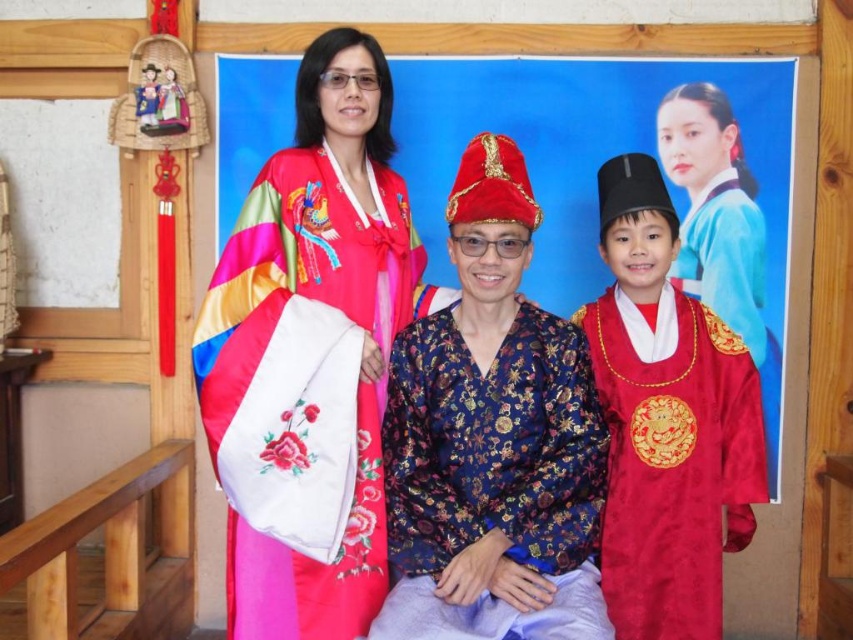
Question: Does silky satin kimono at upper left have a greater width compared to silky red robe at center?

Choices:
 (A) no
 (B) yes

Answer: (B)

Question: Is shiny brocade robe at center smaller than silky blue robe at upper right?

Choices:
 (A) no
 (B) yes

Answer: (A)

Question: Which point is closer to the camera?

Choices:
 (A) (643, 248)
 (B) (759, 324)
 (C) (761, 355)

Answer: (A)

Question: Which of the following is the farthest from the observer?

Choices:
 (A) (683, 573)
 (B) (711, 230)
 (C) (515, 529)
 (D) (717, 314)

Answer: (B)

Question: Estimate the real-world distances between objects in this image. Which object is farther from the silky satin hanbok at center?

Choices:
 (A) silky blue robe at upper right
 (B) shiny brocade robe at center
 (C) silky satin kimono at upper left

Answer: (A)

Question: Is silky satin hanbok at center wider than silky red robe at center?

Choices:
 (A) no
 (B) yes

Answer: (B)